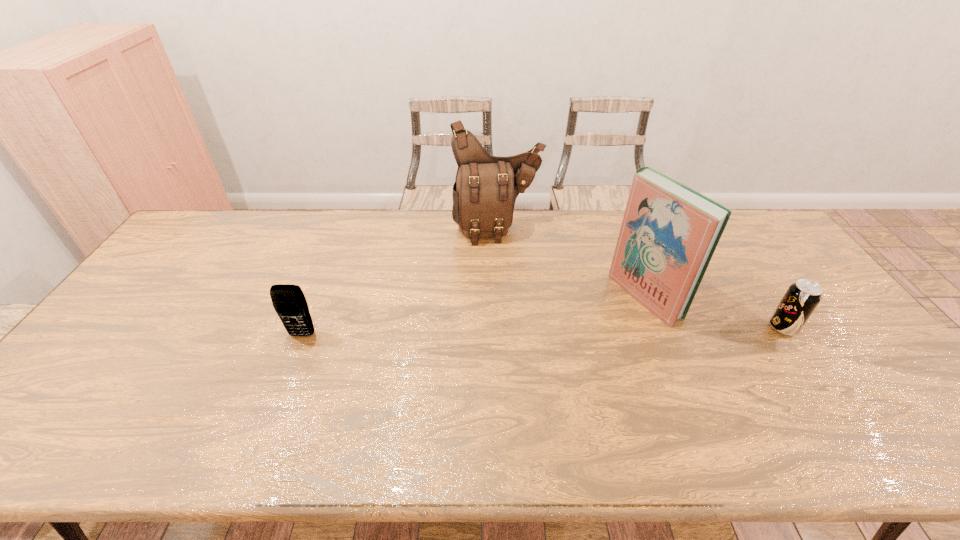
Identify the location of free space between the shoulder bag and the hardback book. (571, 263).

Locate an element on the screen. The width and height of the screenshot is (960, 540). blank region between the soda can and the leftmost object is located at coordinates (542, 331).

Where is `free space between the cellular telephone and the soda can`? This screenshot has height=540, width=960. free space between the cellular telephone and the soda can is located at coordinates (542, 331).

The height and width of the screenshot is (540, 960). What are the coordinates of `free space between the second object from left to right and the cellular telephone` in the screenshot? It's located at (399, 282).

Identify which object is the third nearest to the leftmost object. Please provide its 2D coordinates. Your answer should be formatted as a tuple, i.e. [(x, y)], where the tuple contains the x and y coordinates of a point satisfying the conditions above.

[(802, 297)]

Select which object appears as the second closest to the soda can. Please provide its 2D coordinates. Your answer should be formatted as a tuple, i.e. [(x, y)], where the tuple contains the x and y coordinates of a point satisfying the conditions above.

[(486, 187)]

This screenshot has width=960, height=540. In order to click on free point that satisfies the following two spatial constraints: 1. on the front side of the second object from left to right; 2. on the left side of the soda can in this screenshot , I will do `click(502, 327)`.